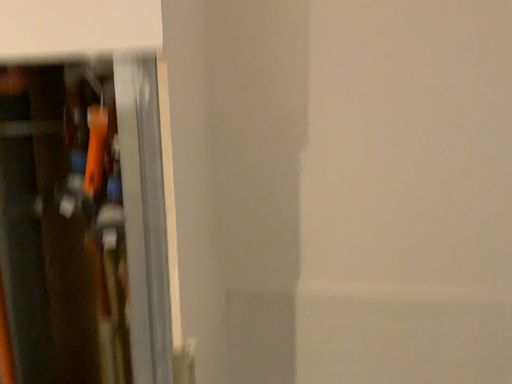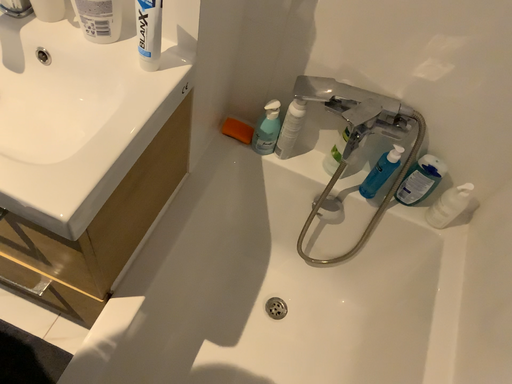
Question: How did the camera likely rotate when shooting the video?

Choices:
 (A) rotated upward
 (B) rotated downward

Answer: (B)